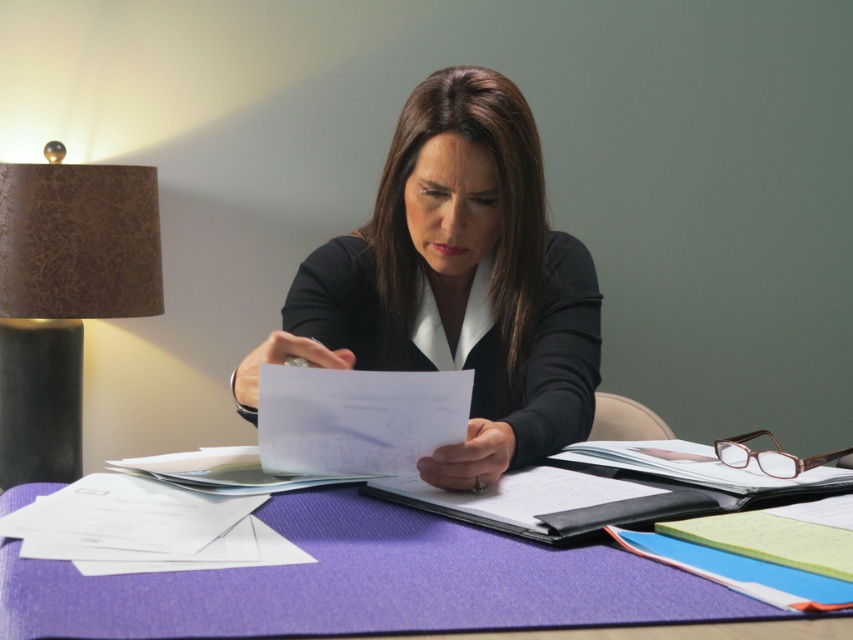
Question: Based on their relative distances, which object is nearer to the black leather notebook at center?

Choices:
 (A) black matte blazer at center
 (B) purple fabric at center

Answer: (B)

Question: Which point is closer to the camera?

Choices:
 (A) (354, 572)
 (B) (434, 470)
 (C) (57, 365)
 (D) (614, 518)

Answer: (A)

Question: Is black matte blazer at center wider than black leather notebook at center?

Choices:
 (A) yes
 (B) no

Answer: (A)

Question: Is black matte blazer at center below brown textured lampshade at left?

Choices:
 (A) yes
 (B) no

Answer: (B)

Question: Which is farther from the purple fabric at center?

Choices:
 (A) black leather notebook at center
 (B) brown textured lampshade at left

Answer: (B)

Question: Does black matte blazer at center have a larger size compared to black leather notebook at center?

Choices:
 (A) yes
 (B) no

Answer: (A)